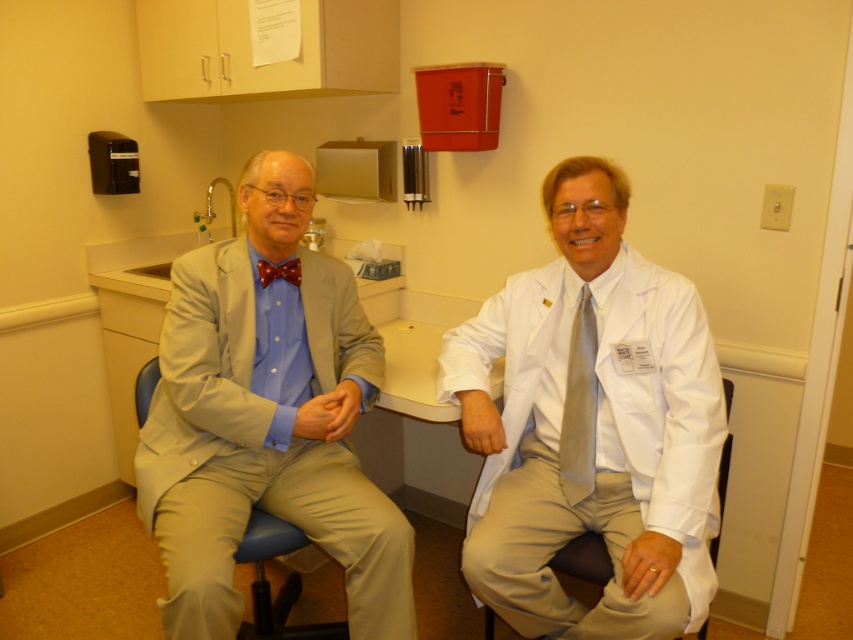
Which is in front, point (595, 324) or point (259, 260)?

Point (595, 324)

In order to click on silvery smooth tie at center in this screenshot , I will do `click(579, 404)`.

Is point (566, 440) closer to viewer compared to point (280, 273)?

No, it is not.

You are a GUI agent. You are given a task and a screenshot of the screen. Output one action in this format:
    pyautogui.click(x=<x>, y=<y>)
    Task: Click on the silvery smooth tie at center
    
    Given the screenshot: What is the action you would take?
    pyautogui.click(x=579, y=404)

Does white smooth lab coat at center appear on the left side of light beige suit at left?

No, white smooth lab coat at center is not to the left of light beige suit at left.

Is white smooth lab coat at center taller than light beige suit at left?

Yes, white smooth lab coat at center is taller than light beige suit at left.

Image resolution: width=853 pixels, height=640 pixels. What are the coordinates of `white smooth lab coat at center` in the screenshot? It's located at (590, 426).

Which is behind, point (466, 355) or point (320, 636)?

Positioned behind is point (320, 636).

Who is more distant from viewer, (x=473, y=524) or (x=300, y=538)?

The point (x=473, y=524) is more distant.

Image resolution: width=853 pixels, height=640 pixels. I want to click on white smooth lab coat at center, so click(590, 426).